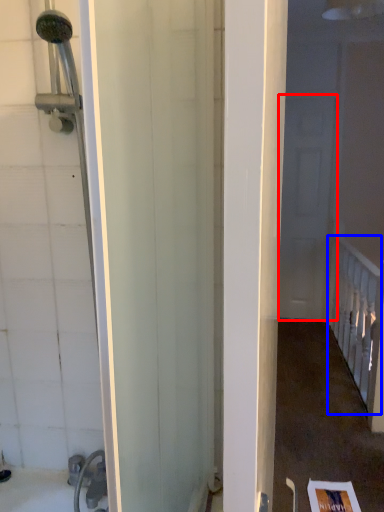
Question: Which of the following is the farthest to the observer, screen door (highlighted by a red box) or rail (highlighted by a blue box)?

Choices:
 (A) screen door
 (B) rail

Answer: (A)